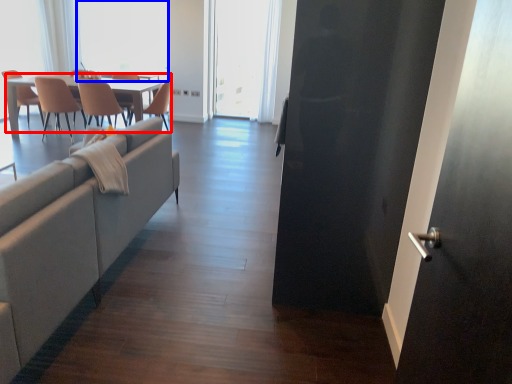
Question: Which of the following is the farthest to the observer, kitchen & dining room table (highlighted by a red box) or window screen (highlighted by a blue box)?

Choices:
 (A) kitchen & dining room table
 (B) window screen

Answer: (B)